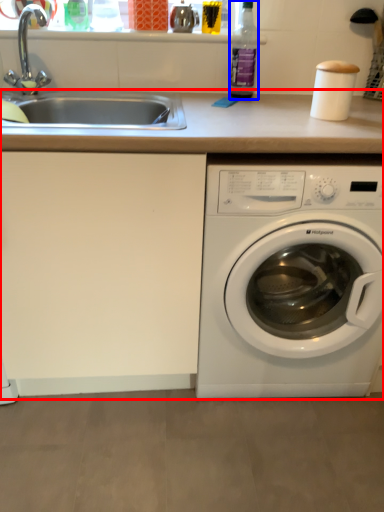
Question: Which point is further to the camera, counter top (highlighted by a red box) or bottle (highlighted by a blue box)?

Choices:
 (A) counter top
 (B) bottle

Answer: (B)